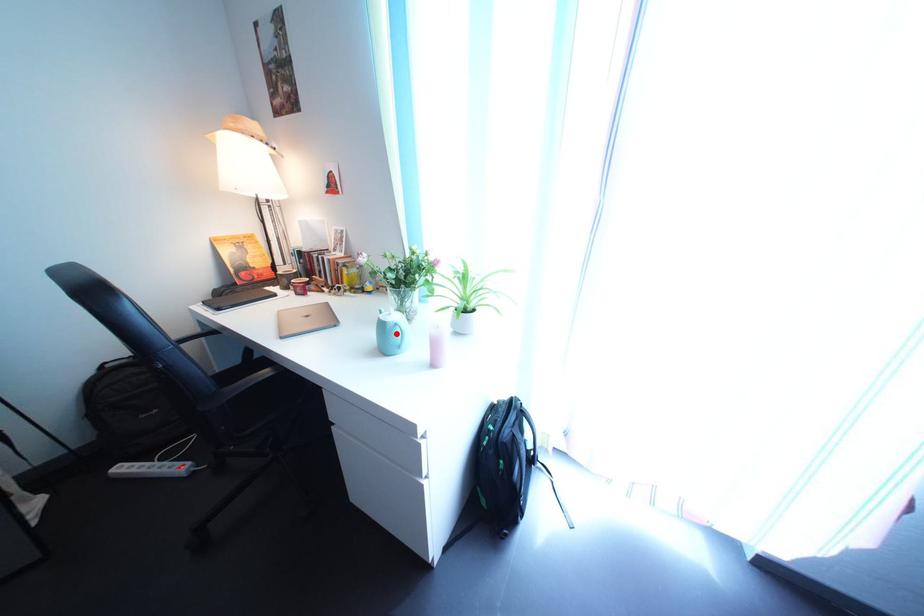
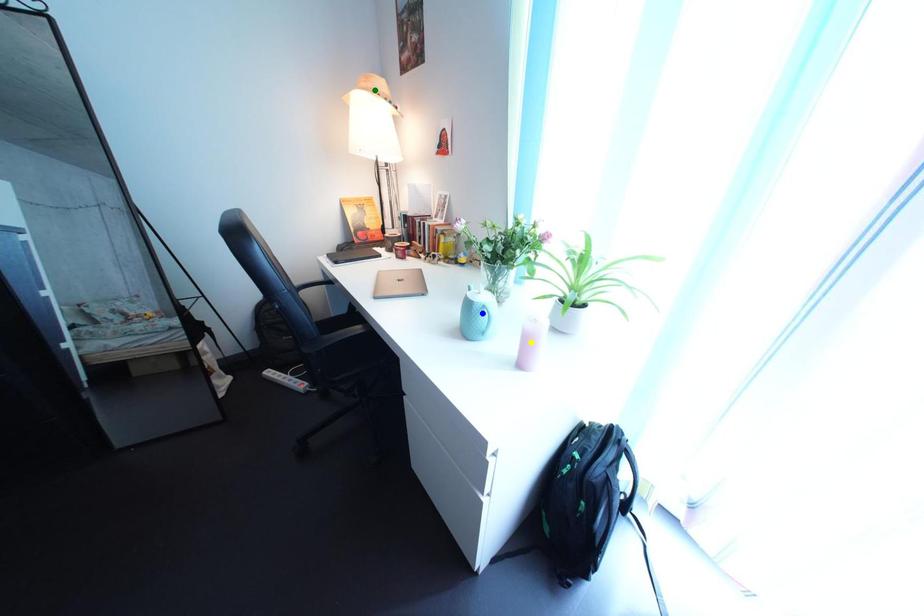
Question: I am providing you with two images of the same scene from different viewpoints. A red point is marked on the first image. You are given multiple points on the second image. In image 2, which mark is for the same physical point as the one in image 1?

Choices:
 (A) green point
 (B) yellow point
 (C) blue point

Answer: (C)